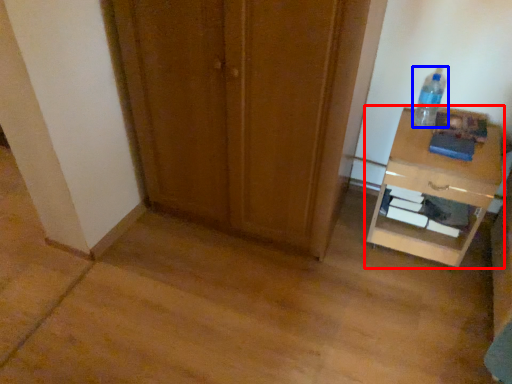
Question: Which point is further to the camera, nightstand (highlighted by a red box) or bottle (highlighted by a blue box)?

Choices:
 (A) nightstand
 (B) bottle

Answer: (B)